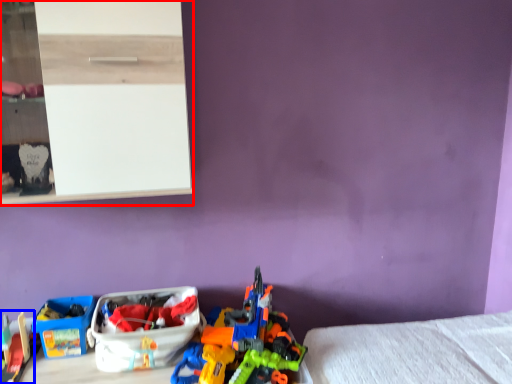
Question: Among these objects, which one is nearest to the camera, shelf (highlighted by a red box) or toy (highlighted by a blue box)?

Choices:
 (A) shelf
 (B) toy

Answer: (A)